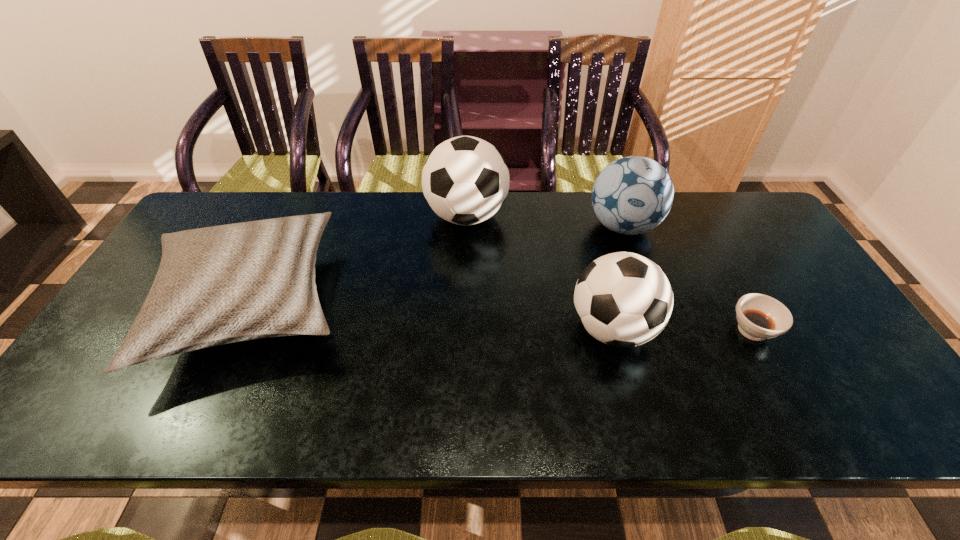
This screenshot has width=960, height=540. I want to click on vacant space that is in between the nearest soccer ball and the shortest object, so click(683, 329).

Find the location of a particular element. The height and width of the screenshot is (540, 960). free space between the soup bowl and the fourth tallest object is located at coordinates click(501, 317).

You are a GUI agent. You are given a task and a screenshot of the screen. Output one action in this format:
    pyautogui.click(x=<x>, y=<y>)
    Task: Click on the free space between the cushion and the leftmost soccer ball
    
    Given the screenshot: What is the action you would take?
    pyautogui.click(x=359, y=260)

Identify the location of free space between the cushion and the nearest soccer ball. coord(432,316).

Locate an element on the screen. The image size is (960, 540). empty space that is in between the leftmost object and the second object from left to right is located at coordinates (359, 260).

Locate an element on the screen. object that is the closest to the fourth object from right to left is located at coordinates point(216,285).

The image size is (960, 540). What are the coordinates of `the fourth closest object relative to the cushion` in the screenshot? It's located at (759, 317).

At what (x,y) coordinates should I click in order to perform the action: click on the second closest soccer ball relative to the second object from left to right. Please return your answer as a coordinate pair (x, y). The width and height of the screenshot is (960, 540). Looking at the image, I should click on (623, 299).

Locate an element on the screen. soccer ball that is the second closest to the cushion is located at coordinates (623, 299).